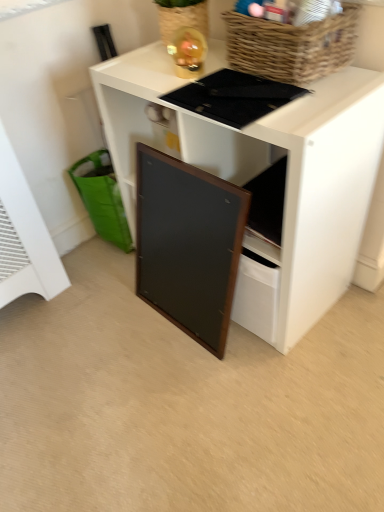
Question: Does black matte board at center appear on the left side of wooden framed board at center?

Choices:
 (A) yes
 (B) no

Answer: (B)

Question: Can you confirm if black matte board at center is wider than wooden framed board at center?

Choices:
 (A) no
 (B) yes

Answer: (B)

Question: Is black matte board at center completely or partially outside of wooden framed board at center?

Choices:
 (A) no
 (B) yes

Answer: (B)

Question: Considering the relative sizes of black matte board at center and wooden framed board at center in the image provided, is black matte board at center thinner than wooden framed board at center?

Choices:
 (A) no
 (B) yes

Answer: (A)

Question: Does black matte board at center appear on the right side of wooden framed board at center?

Choices:
 (A) no
 (B) yes

Answer: (B)

Question: Is black matte board at center further to camera compared to wooden framed board at center?

Choices:
 (A) yes
 (B) no

Answer: (B)

Question: Is green fabric shopping basket at lower left shorter than black matte board at center?

Choices:
 (A) no
 (B) yes

Answer: (B)

Question: From the image's perspective, is green fabric shopping basket at lower left on top of black matte board at center?

Choices:
 (A) yes
 (B) no

Answer: (A)

Question: Considering the relative sizes of green fabric shopping basket at lower left and black matte board at center in the image provided, is green fabric shopping basket at lower left thinner than black matte board at center?

Choices:
 (A) yes
 (B) no

Answer: (A)

Question: Can you see green fabric shopping basket at lower left touching black matte board at center?

Choices:
 (A) yes
 (B) no

Answer: (B)

Question: Can you confirm if green fabric shopping basket at lower left is bigger than black matte board at center?

Choices:
 (A) yes
 (B) no

Answer: (B)

Question: Could you tell me if green fabric shopping basket at lower left is facing black matte board at center?

Choices:
 (A) no
 (B) yes

Answer: (A)

Question: From the image's perspective, is woven brown basket at upper right on green fabric shopping basket at lower left?

Choices:
 (A) no
 (B) yes

Answer: (B)